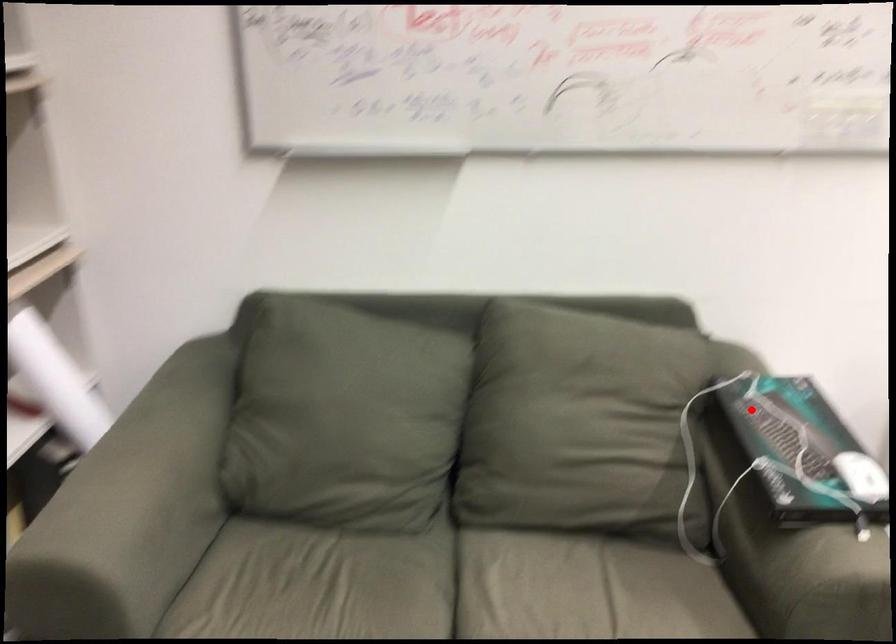
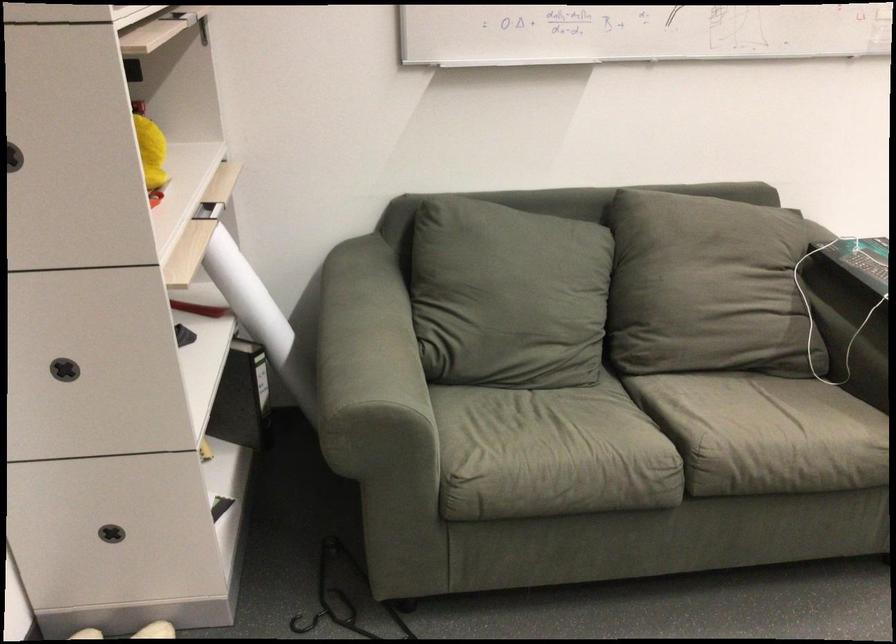
In the second image, find the point that corresponds to the highlighted location in the first image.

(860, 259)